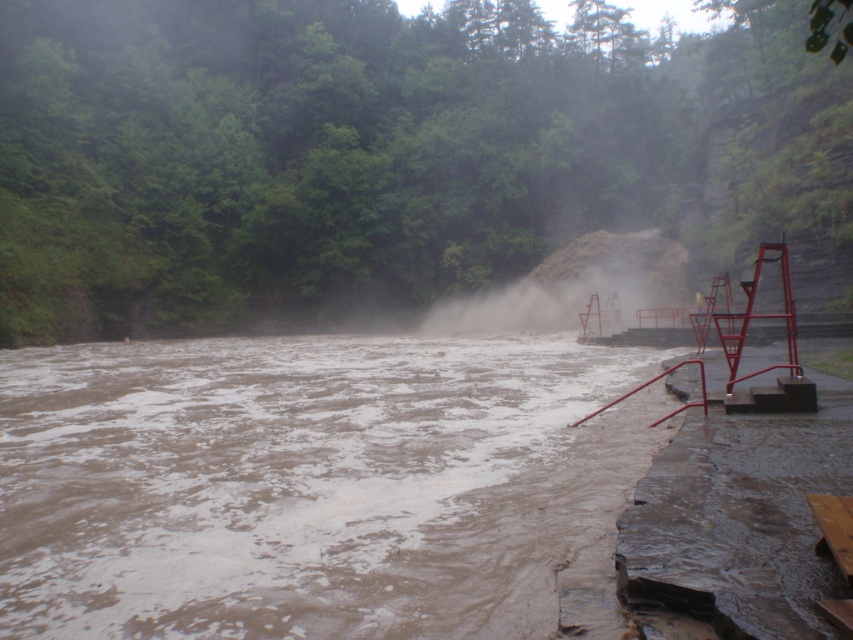
Question: Does muddy water at lower left appear over white dusty steam at center?

Choices:
 (A) no
 (B) yes

Answer: (A)

Question: Where is muddy water at lower left located in relation to white dusty steam at center in the image?

Choices:
 (A) right
 (B) left

Answer: (B)

Question: Does muddy water at lower left appear on the left side of white dusty steam at center?

Choices:
 (A) yes
 (B) no

Answer: (A)

Question: Among these points, which one is farthest from the camera?

Choices:
 (A) (654, 429)
 (B) (517, 291)

Answer: (B)